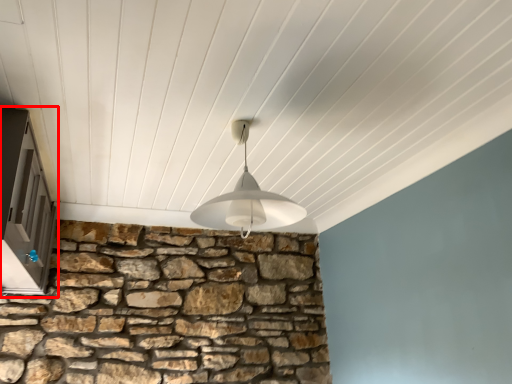
Question: From the image's perspective, what is the correct spatial relationship of window (annotated by the red box) in relation to lamp?

Choices:
 (A) above
 (B) below

Answer: (B)